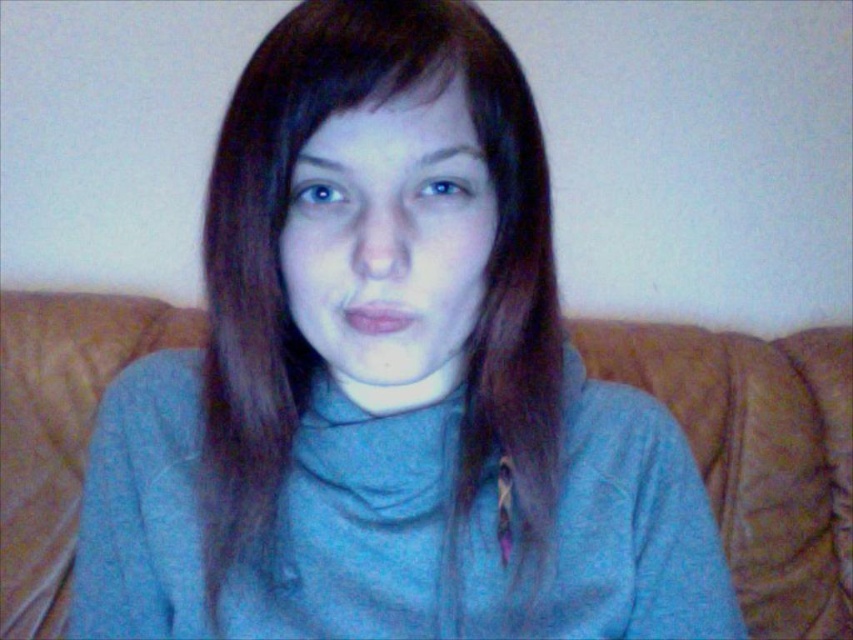
Question: Does matte gray face at center appear under brown matte hair at upper center?

Choices:
 (A) yes
 (B) no

Answer: (A)

Question: Is matte gray face at center smaller than brown matte hair at upper center?

Choices:
 (A) no
 (B) yes

Answer: (A)

Question: Which point is closer to the camera taking this photo?

Choices:
 (A) (465, 99)
 (B) (691, 384)
 (C) (416, 262)

Answer: (C)

Question: Which point appears closest to the camera in this image?

Choices:
 (A) (361, 92)
 (B) (761, 500)
 (C) (376, 150)

Answer: (A)

Question: Is brown leather couch at center above matte gray face at center?

Choices:
 (A) yes
 (B) no

Answer: (B)

Question: Estimate the real-world distances between objects in this image. Which object is farther from the brown leather couch at center?

Choices:
 (A) brown matte hair at upper center
 (B) matte gray face at center

Answer: (A)